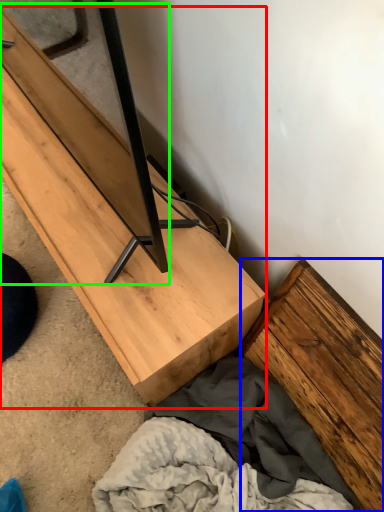
Question: Which is farther away from furniture (highlighted by a red box)? plank (highlighted by a blue box) or plank (highlighted by a green box)?

Choices:
 (A) plank
 (B) plank

Answer: (A)